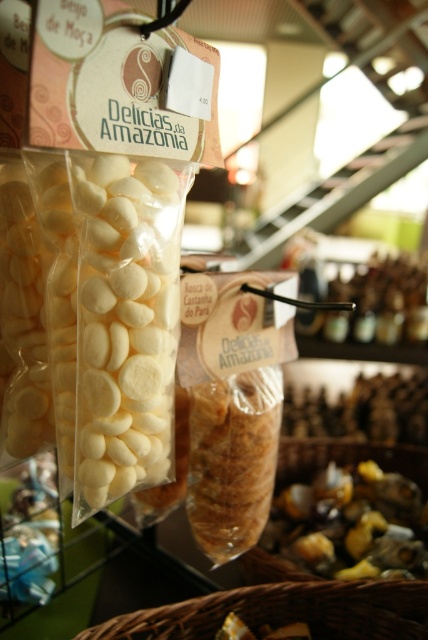
In the scene shown: Can you confirm if white matte candy at center is shorter than woven brown basket at lower center?

Incorrect, white matte candy at center's height does not fall short of woven brown basket at lower center's.

Does white matte candy at center have a greater height compared to woven brown basket at lower center?

Yes.

Which is behind, point (97, 490) or point (226, 600)?

The point (226, 600) is behind.

You are a GUI agent. You are given a task and a screenshot of the screen. Output one action in this format:
    pyautogui.click(x=<x>, y=<y>)
    Task: Click on the white matte candy at center
    The height and width of the screenshot is (640, 428).
    Given the screenshot: What is the action you would take?
    pyautogui.click(x=110, y=314)

Does shiny metallic nuts at lower right come in front of woven brown basket at lower center?

No, shiny metallic nuts at lower right is further to the viewer.

Between point (422, 529) and point (412, 592), which one is positioned in front?

Point (412, 592)

Which is behind, point (371, 531) or point (259, 611)?

The point (371, 531) is more distant.

You are a GUI agent. You are given a task and a screenshot of the screen. Output one action in this format:
    pyautogui.click(x=<x>, y=<y>)
    Task: Click on the shiny metallic nuts at lower right
    
    Given the screenshot: What is the action you would take?
    pyautogui.click(x=350, y=524)

Is white matte candy at center above shiny metallic nuts at lower right?

Yes, white matte candy at center is above shiny metallic nuts at lower right.

Who is shorter, white matte candy at center or shiny metallic nuts at lower right?

shiny metallic nuts at lower right

You are a GUI agent. You are given a task and a screenshot of the screen. Output one action in this format:
    pyautogui.click(x=<x>, y=<y>)
    Task: Click on the white matte candy at center
    The width and height of the screenshot is (428, 640).
    Given the screenshot: What is the action you would take?
    pyautogui.click(x=110, y=314)